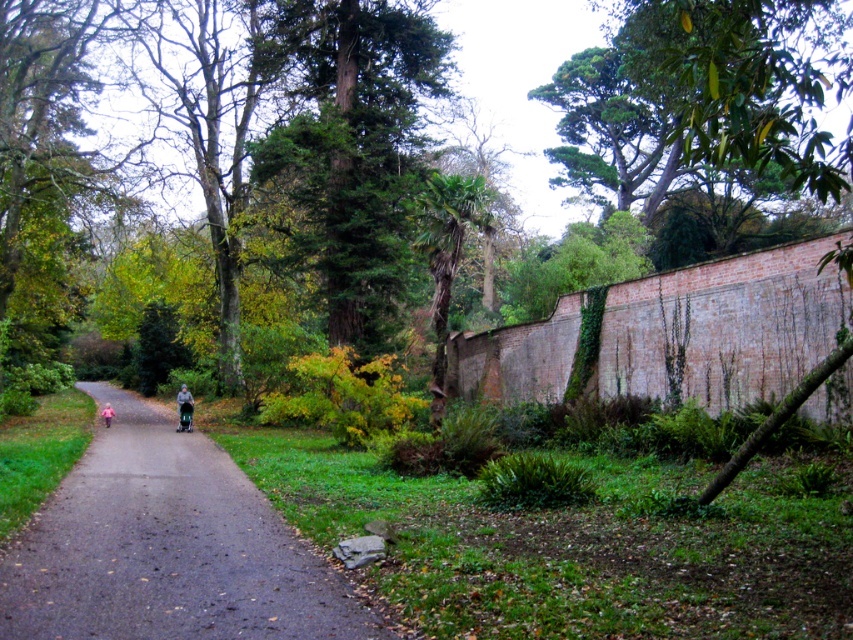
Who is positioned more to the left, green textured tree at center or pink fabric at center?

pink fabric at center

Does green textured tree at center come behind pink fabric at center?

No, green textured tree at center is closer to the viewer.

Who is more forward, (339, 172) or (105, 413)?

Positioned in front is point (339, 172).

Identify the location of green textured tree at center. (354, 148).

Is dark asphalt path at center shorter than green textured tree at center?

Yes, dark asphalt path at center is shorter than green textured tree at center.

Between point (195, 496) and point (349, 13), which one is positioned in front?

Positioned in front is point (195, 496).

Does point (267, 573) come behind point (343, 54)?

No, it is not.

Where is `dark asphalt path at center`? This screenshot has width=853, height=640. dark asphalt path at center is located at coordinates (166, 547).

Can you confirm if dark asphalt path at center is bigger than gray fabric stroller at center?

Correct, dark asphalt path at center is larger in size than gray fabric stroller at center.

Between point (144, 413) and point (187, 417), which one is positioned behind?

The point (144, 413) is more distant.

Find the location of a particular element. Image resolution: width=853 pixels, height=640 pixels. dark asphalt path at center is located at coordinates tap(166, 547).